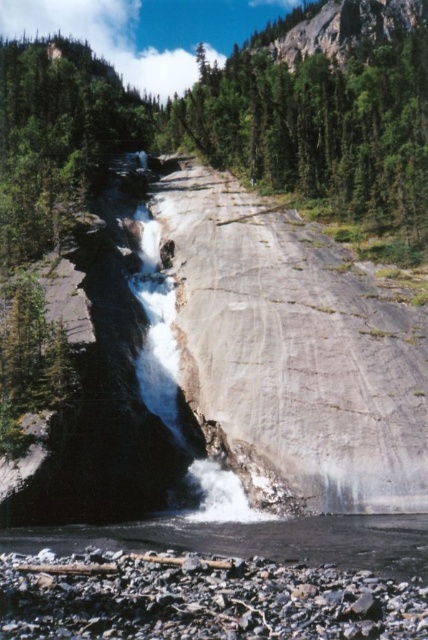
Can you confirm if green leafy tree at center is positioned below smooth gray rock at lower center?

No.

Can you confirm if green leafy tree at center is bigger than smooth gray rock at lower center?

Indeed, green leafy tree at center has a larger size compared to smooth gray rock at lower center.

Identify the location of green leafy tree at center. Image resolution: width=428 pixels, height=640 pixels. (323, 112).